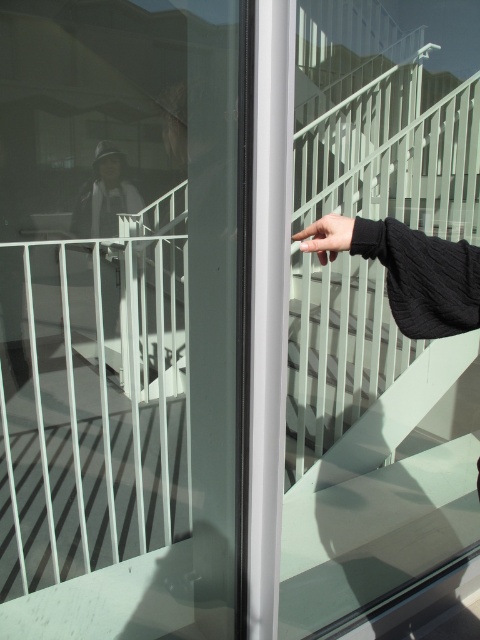
Question: Does transparent glass screen door at center have a greater width compared to black matte hand at center?

Choices:
 (A) yes
 (B) no

Answer: (A)

Question: Does transparent glass screen door at center have a larger size compared to black matte hand at center?

Choices:
 (A) yes
 (B) no

Answer: (A)

Question: Which of the following is the farthest from the observer?

Choices:
 (A) (325, 237)
 (B) (195, 332)

Answer: (B)

Question: Which object appears farthest from the camera in this image?

Choices:
 (A) transparent glass screen door at center
 (B) black matte hand at center

Answer: (A)

Question: Is the position of transparent glass screen door at center more distant than that of black matte hand at center?

Choices:
 (A) yes
 (B) no

Answer: (A)